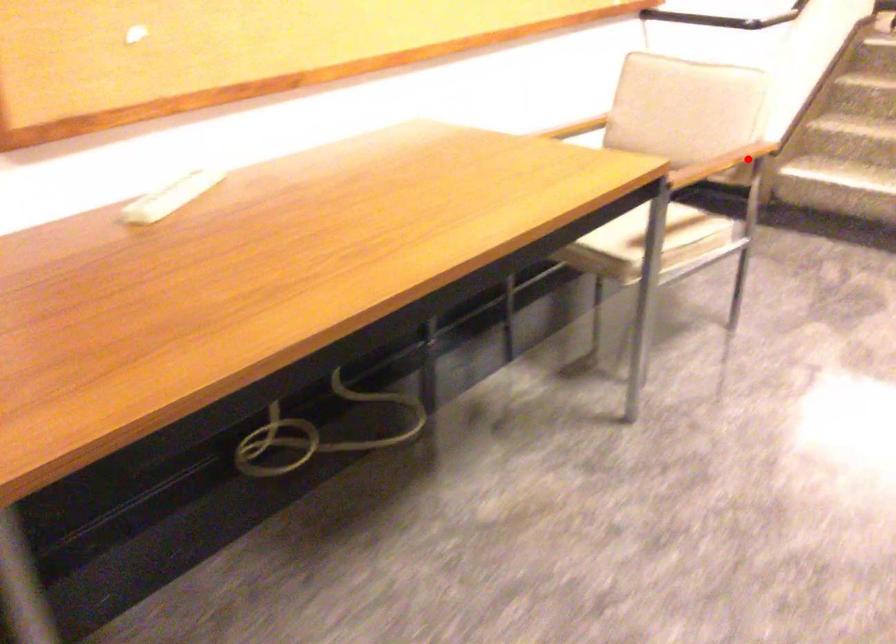
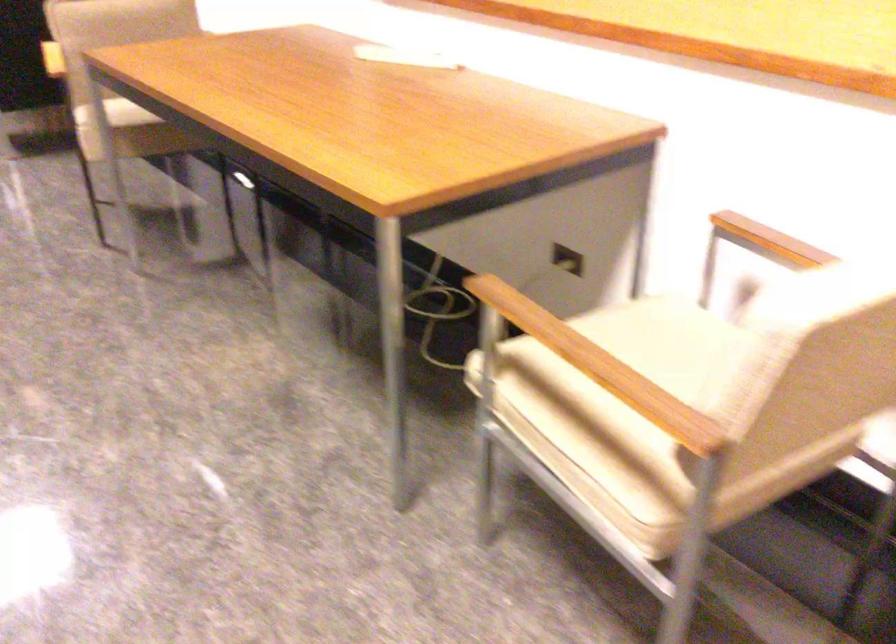
Question: I am providing you with two images of the same scene from different viewpoints. Given a red point in image1, look at the same physical point in image2. Is it:

Choices:
 (A) Closer to the viewpoint
 (B) Farther from the viewpoint

Answer: (A)